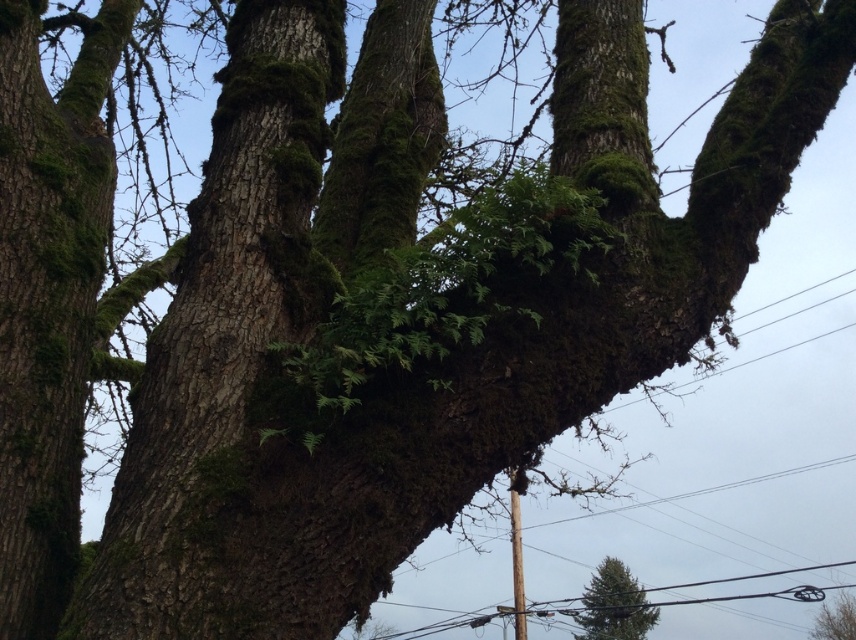
You are standing in front of a large tree with a thick trunk and mossy branches. You notice a specific point marked at coordinates point (48,298). Based on the scene description, which object does this coordinate correspond to?

The point (48,298) corresponds to the green mossy tree trunk at left.

You are a hiker trying to determine which tree is taller between the green mossy tree trunk at left and the green mossy tree at center. Based on the scene, which one is taller?

The green mossy tree trunk at left is taller than the green mossy tree at center according to the description.

You are a botanist examining the tree and need to locate the green mossy bark at center. Based on the coordinates provided, where exactly would you find it on the tree?

The green mossy bark at center is located at point coordinates of 0.503 on the x axis and 0.258 on the y axis.